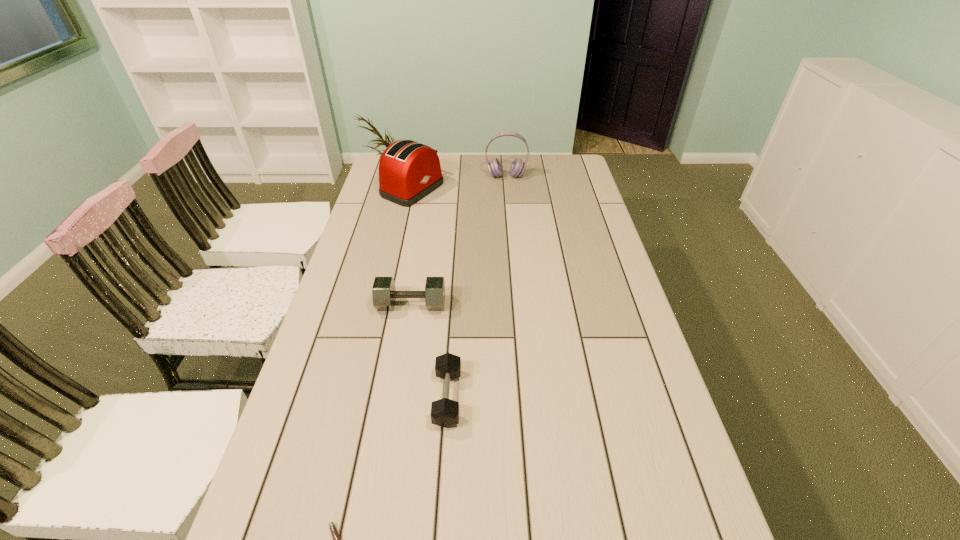
You are a GUI agent. You are given a task and a screenshot of the screen. Output one action in this format:
    pyautogui.click(x=<x>, y=<y>)
    Task: Click on the headset positioned at the far edge
    
    Given the screenshot: What is the action you would take?
    pyautogui.click(x=517, y=168)

Image resolution: width=960 pixels, height=540 pixels. I want to click on toaster located in the far edge section of the desktop, so click(x=408, y=171).

The height and width of the screenshot is (540, 960). Identify the location of toaster that is positioned at the left edge. (408, 171).

Find the location of a particular element. This screenshot has height=540, width=960. dumbbell present at the left edge is located at coordinates (384, 294).

This screenshot has width=960, height=540. I want to click on object that is at the far left corner, so [408, 171].

Locate an element on the screen. Image resolution: width=960 pixels, height=540 pixels. vacant space at the far edge is located at coordinates coord(509,180).

In the image, there is a desktop. Where is `free space at the left edge`? free space at the left edge is located at coordinates (354, 395).

I want to click on vacant space at the right edge of the desktop, so click(622, 313).

This screenshot has height=540, width=960. What are the coordinates of `free area in between the toaster and the headset` in the screenshot? It's located at (459, 183).

This screenshot has width=960, height=540. I want to click on vacant space in between the taller dumbbell and the nearer dumbbell, so click(x=429, y=351).